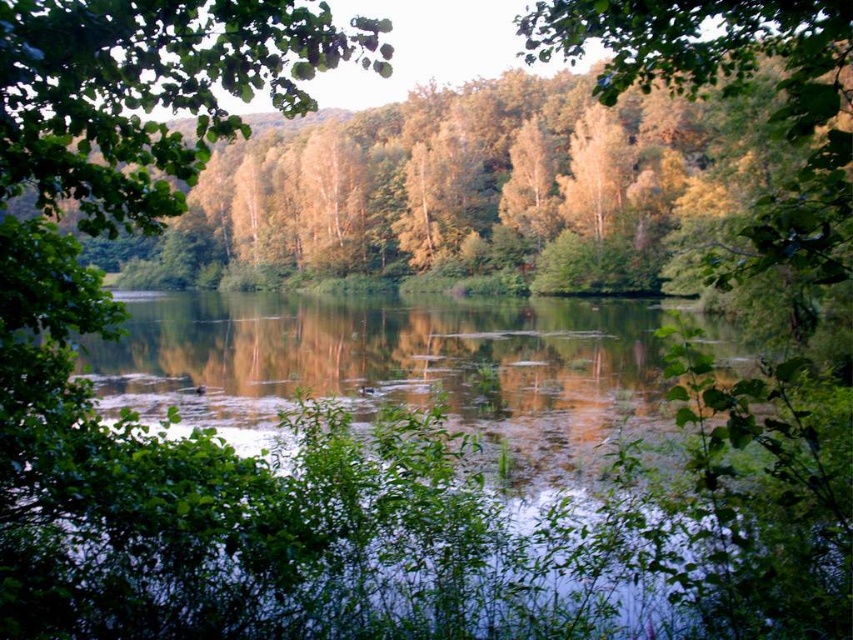
Between green reflective water at center and green leafy tree at upper left, which one has more height?

Standing taller between the two is green leafy tree at upper left.

Is point (357, 545) in front of point (364, 65)?

No, (357, 545) is further to viewer.

Where is `green reflective water at center`? green reflective water at center is located at coordinates (279, 531).